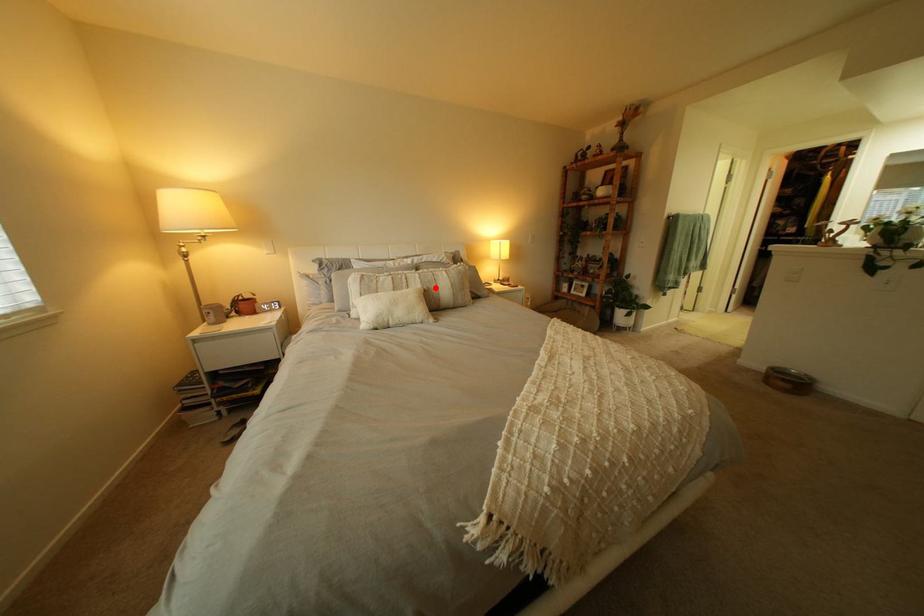
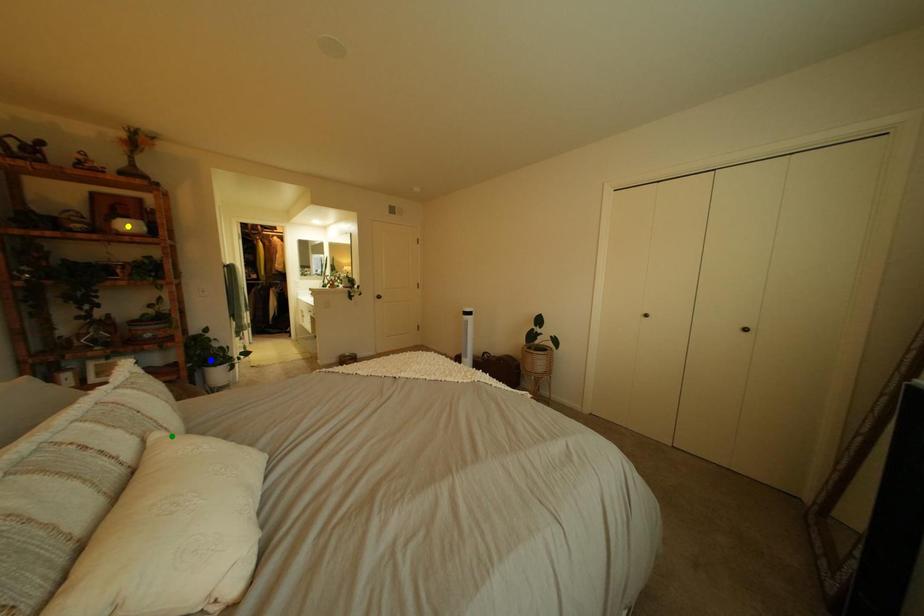
Question: I am providing you with two images of the same scene from different viewpoints. A red point is marked on the first image. You are given multiple points on the second image. Which spot in image 2 lines up with the point in image 1?

Choices:
 (A) blue point
 (B) yellow point
 (C) green point

Answer: (C)